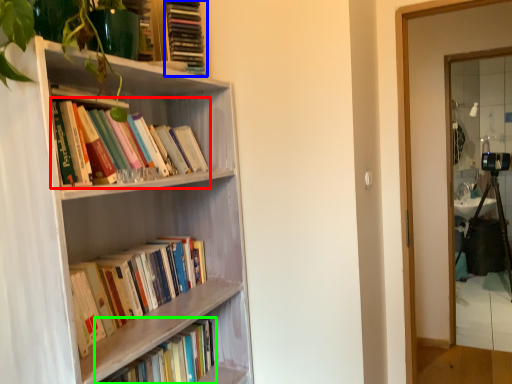
Question: Estimate the real-world distances between objects in this image. Which object is closer to book (highlighted by a red box), book (highlighted by a blue box) or book (highlighted by a green box)?

Choices:
 (A) book
 (B) book

Answer: (A)